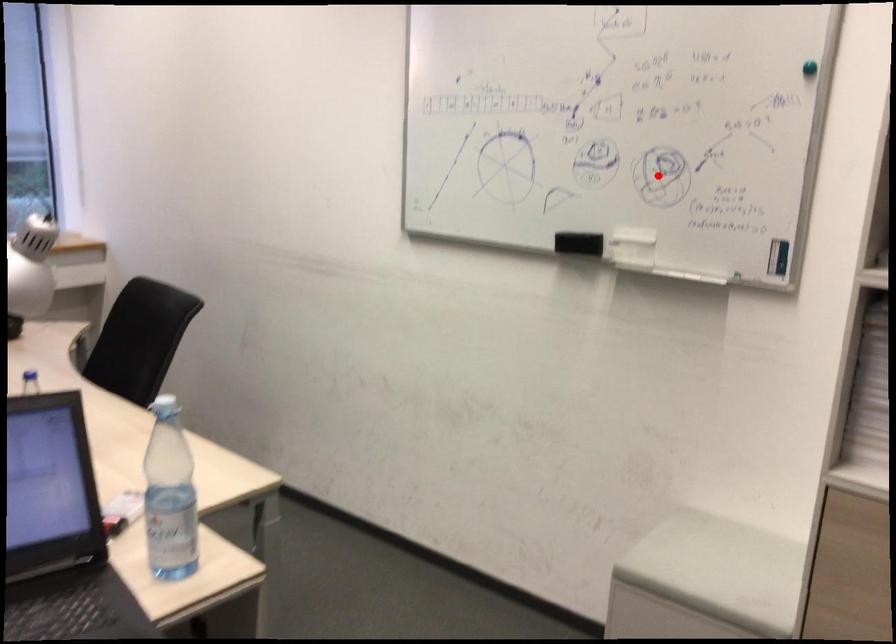
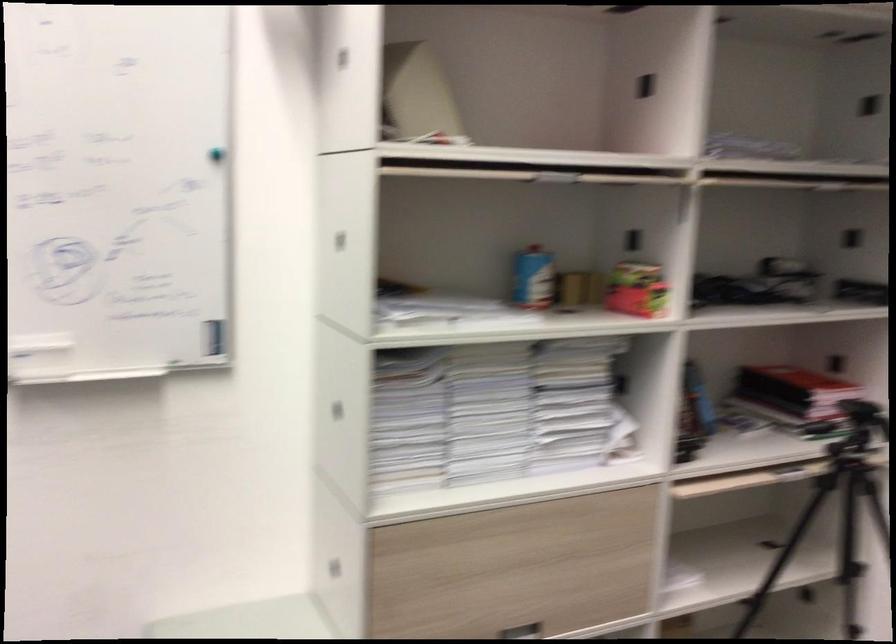
Where in the second image is the point corresponding to the highlighted location from the first image?

(64, 270)